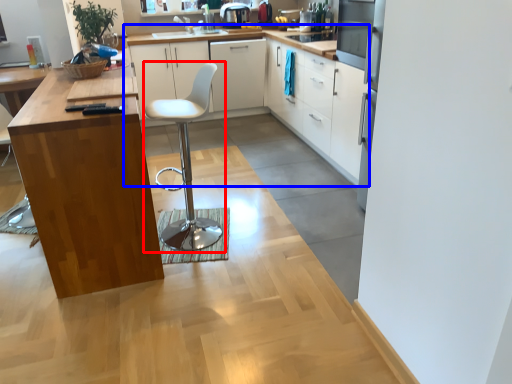
Question: Which point is closer to the camera, swivel chair (highlighted by a red box) or cabinetry (highlighted by a blue box)?

Choices:
 (A) swivel chair
 (B) cabinetry

Answer: (A)